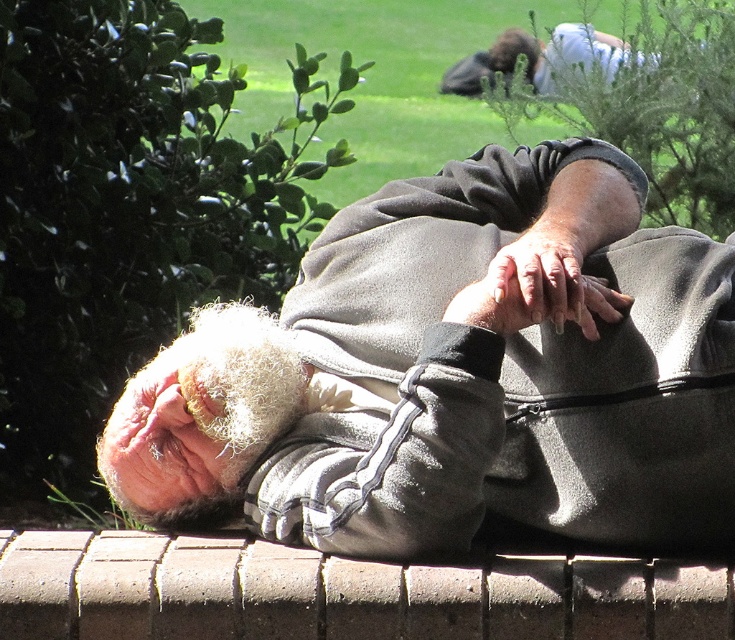
You are a construction worker inspecting the brick at lower center and dry skin at center. Which object is shorter in height?

The brick at lower center has a lesser height compared to dry skin at center, so the brick at lower center is shorter in height.

You are a photographer trying to capture the elderly man in the scene. To ensure the brick at lower center and dry skin at center are both in focus, which object should you adjust your camera focus on first?

The brick at lower center is below dry skin at center, so you should focus on the brick at lower center first to ensure both are in focus as it is closer to the camera.